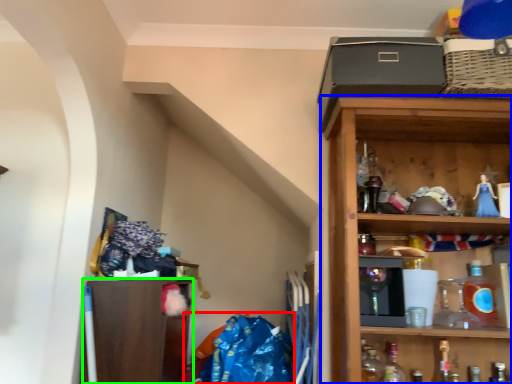
Question: Which is farther away from material (highlighted by a red box)? shelf (highlighted by a blue box) or shelf (highlighted by a green box)?

Choices:
 (A) shelf
 (B) shelf

Answer: (A)